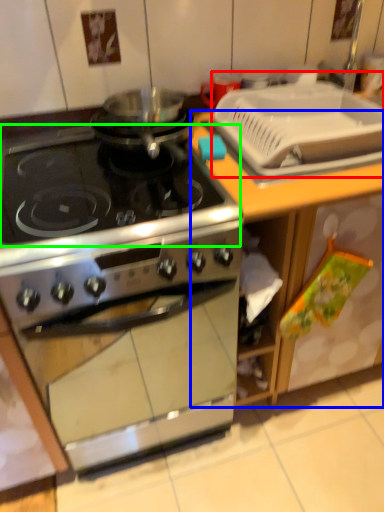
Question: Considering the real-world distances, which object is closest to sink (highlighted by a red box)? counter (highlighted by a blue box) or gas stove (highlighted by a green box).

Choices:
 (A) counter
 (B) gas stove

Answer: (A)